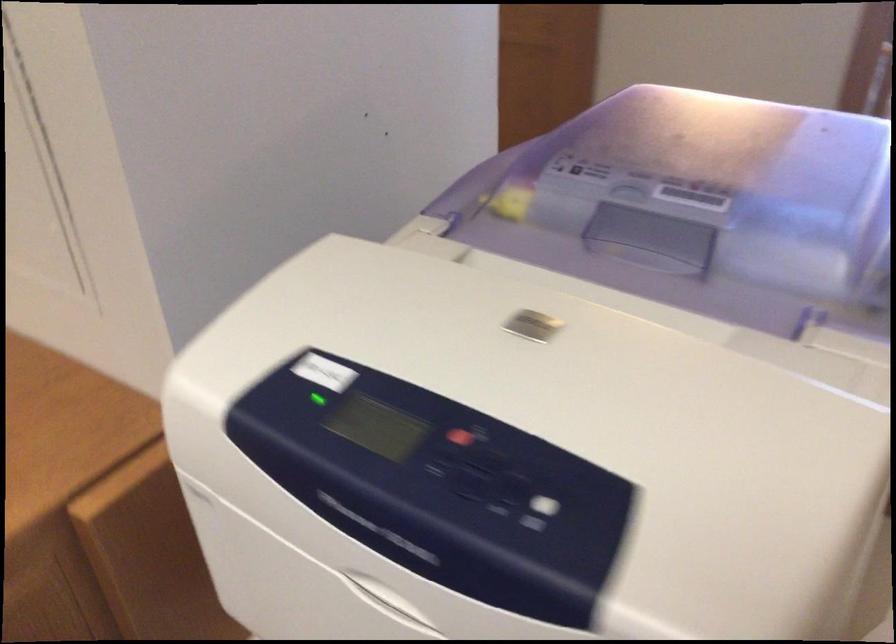
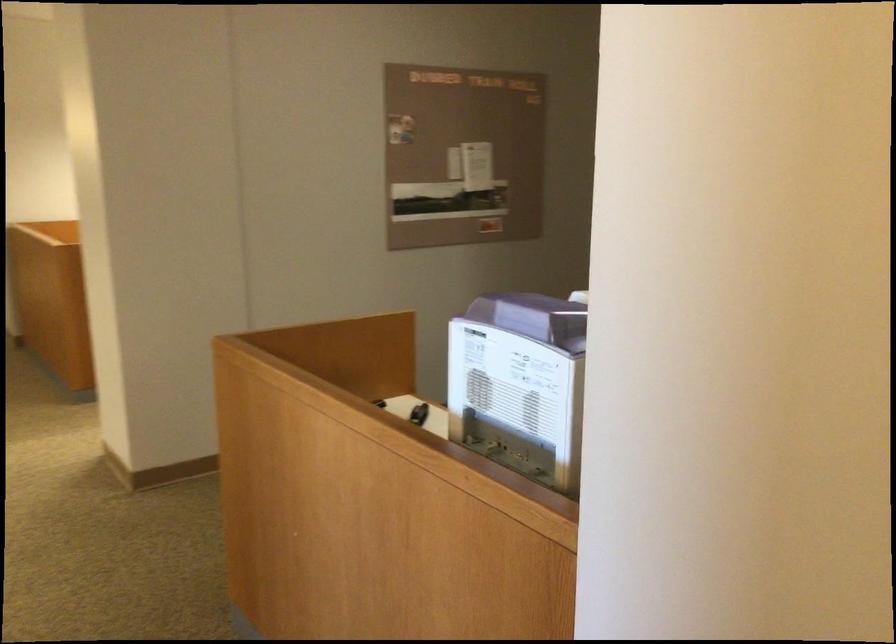
Question: I am providing you with two images of the same scene from different viewpoints. After the viewpoint changes to image2, which objects are now occluded?

Choices:
 (A) white square button
 (B) purple machine lid
 (C) yellow library book
 (D) small black object

Answer: (A)